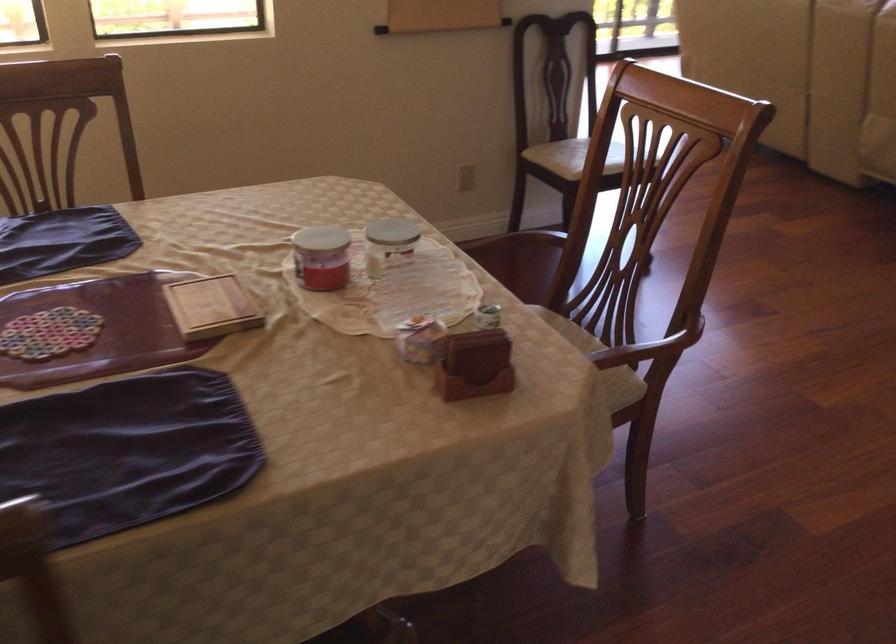
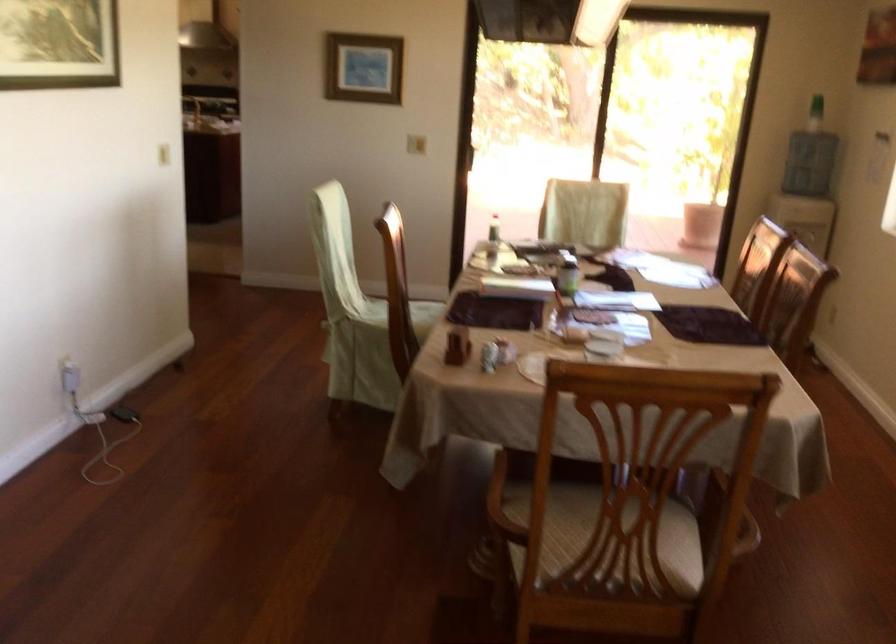
Locate, in the second image, the point that corresponds to the point at 504,348 in the first image.

(458, 345)